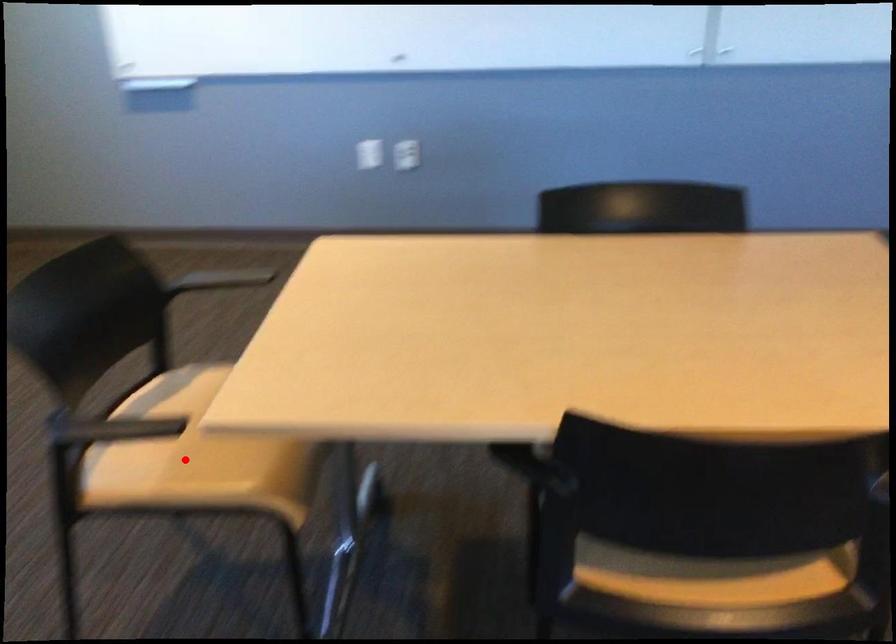
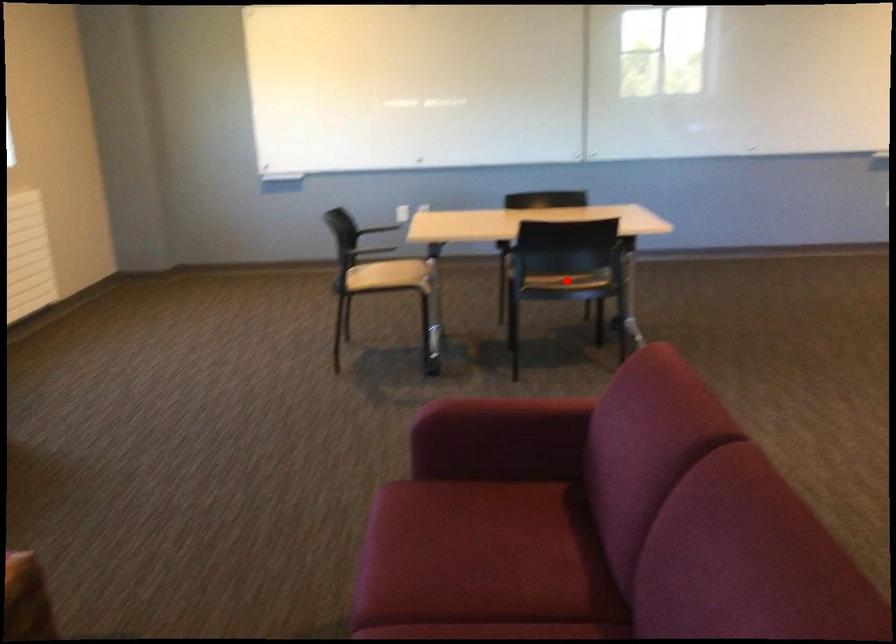
I am providing you with two images of the same scene from different viewpoints. A red point is marked on the first image and another point is marked on the second image. Is the marked point in image1 the same physical position as the marked point in image2?

No